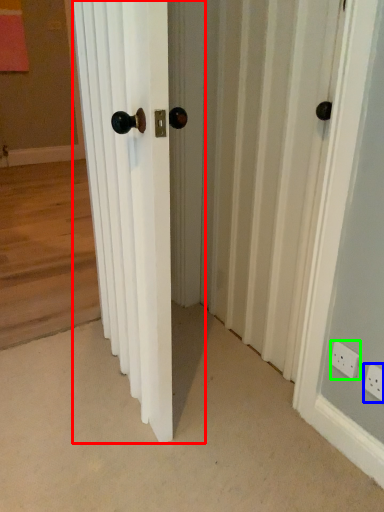
Question: Which is nearer to the door (highlighted by a red box)? electric outlet (highlighted by a blue box) or electric outlet (highlighted by a green box).

Choices:
 (A) electric outlet
 (B) electric outlet

Answer: (B)